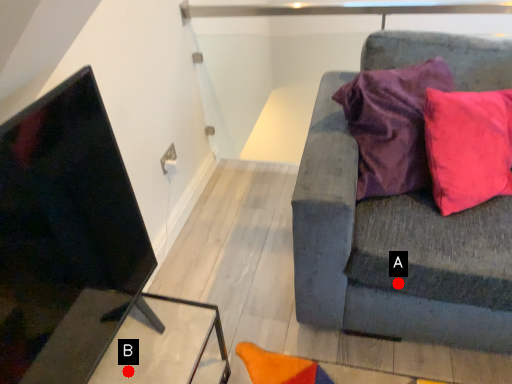
Question: Two points are circled on the image, labeled by A and B beside each circle. Which point appears closest to the camera in this image?

Choices:
 (A) A is closer
 (B) B is closer

Answer: (B)